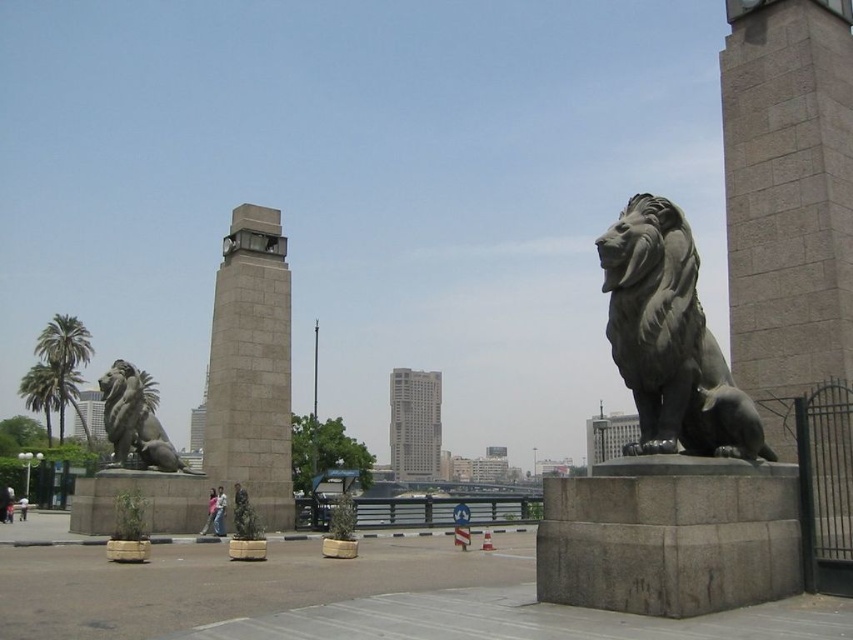
You are standing in the public square and want to know how far the point at coordinates (727, 163) is from you. Can you determine the distance?

The point at coordinates (727, 163) is 44.12 meters away from the viewer.

From the picture: You are standing in the public square and want to take a photo of the bronze lion at right and the gray stone clock tower at center. Which one should you point your camera upwards to capture?

You should point your camera upwards to capture the bronze lion at right because it is positioned above the gray stone clock tower at center.

You are standing in the public square and want to find the gray stone clock tower at center. According to the image, where is the point located at coordinate (251, 365)?

The point at coordinate (251, 365) is on the gray stone clock tower at center.